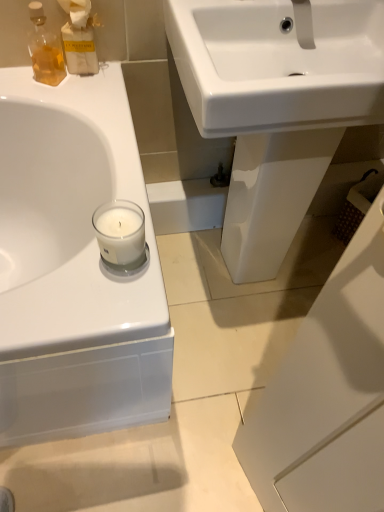
Question: Do you think translucent amber glass bottle at upper left is within matte glass bottle at upper left, or outside of it?

Choices:
 (A) inside
 (B) outside

Answer: (B)

Question: Relative to matte glass bottle at upper left, is translucent amber glass bottle at upper left in front or behind?

Choices:
 (A) behind
 (B) front

Answer: (B)

Question: Estimate the real-world distances between objects in this image. Which object is closer to the matte glass bottle at upper left?

Choices:
 (A) white glossy sink at center
 (B) clear glass candle at left
 (C) translucent amber glass bottle at upper left

Answer: (C)

Question: Estimate the real-world distances between objects in this image. Which object is farther from the translucent amber glass bottle at upper left?

Choices:
 (A) matte glass bottle at upper left
 (B) clear glass candle at left
 (C) white glossy sink at center

Answer: (B)